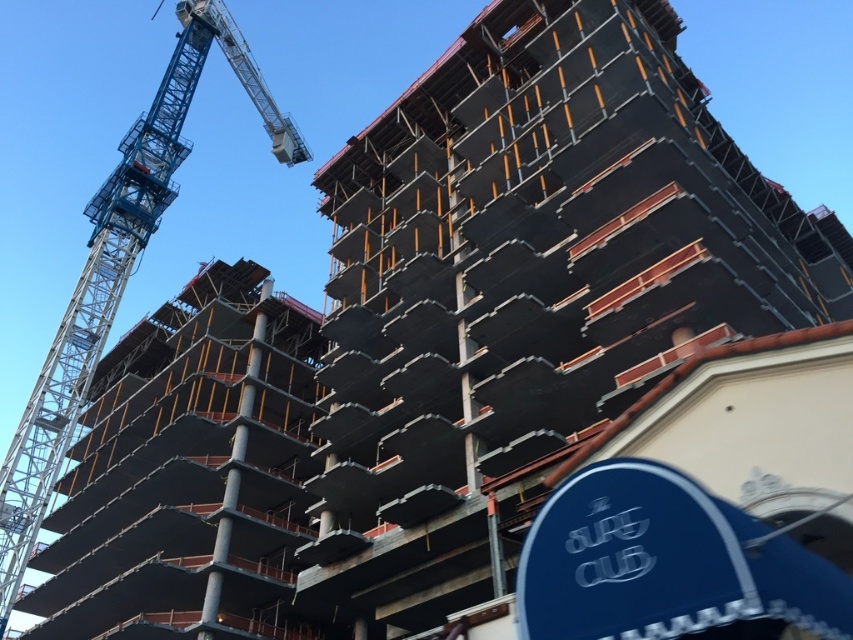
You are an inspector at the construction site. You need to determine which object occupies more space in the image. Which one is larger between the concrete scaffolding at center and the blue metallic crane at upper left?

The concrete scaffolding at center has a larger size compared to the blue metallic crane at upper left, so the concrete scaffolding at center is larger.

You are an inspector assessing the construction site. You need to compare the width of the concrete scaffolding at center and the blue metallic crane at upper left. Which one is wider?

The concrete scaffolding at center is wider than the blue metallic crane at upper left according to the description.

You are a construction worker who needs to move a heavy beam from the blue metallic crane at upper left to the concrete scaffolding at center. Which direction should you move the beam to place it on the scaffolding?

The concrete scaffolding at center is positioned on the right side of the blue metallic crane at upper left, so you should move the beam to the right to place it on the scaffolding.